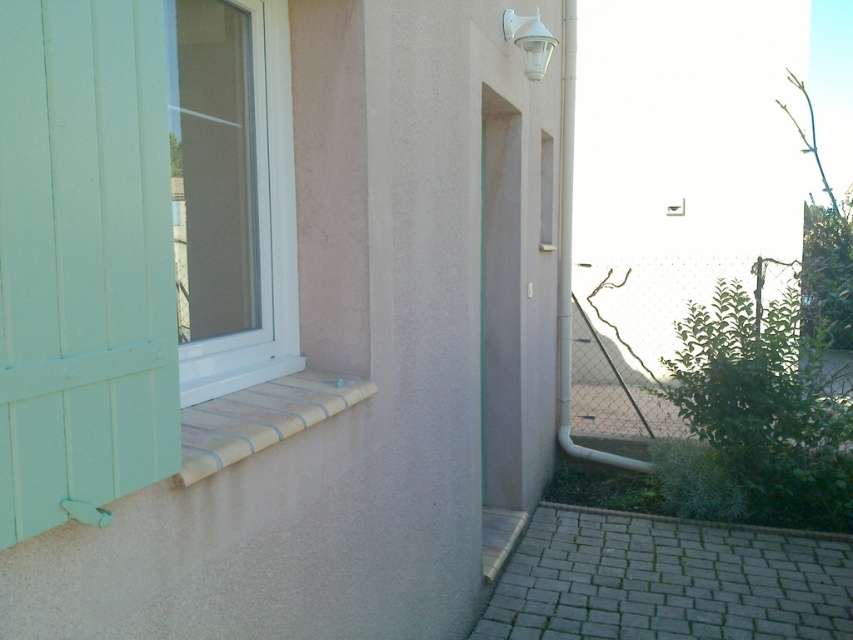
You are standing in front of the residential building described in the scene. You notice the transparent plastic screen door at center. Can you estimate its location using the coordinate system provided?

The transparent plastic screen door at center is located at coordinate point (500, 301).

You are a delivery person trying to enter the building through the doorway. The transparent plastic screen door at center is in your way. Where is the brown textured stone at lower left located relative to the screen door?

The brown textured stone at lower left is below the transparent plastic screen door at center.

You are standing in front of the residential building described. You notice a white plastic window at left. Where is it located relative to the point marked at coordinates (231, 193)?

The white plastic window at left is located at the point marked at coordinates (231, 193).